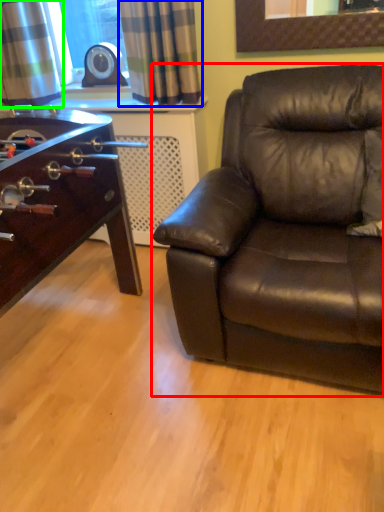
Question: Which is nearer to the studio couch (highlighted by a red box)? curtain (highlighted by a blue box) or curtain (highlighted by a green box).

Choices:
 (A) curtain
 (B) curtain

Answer: (A)